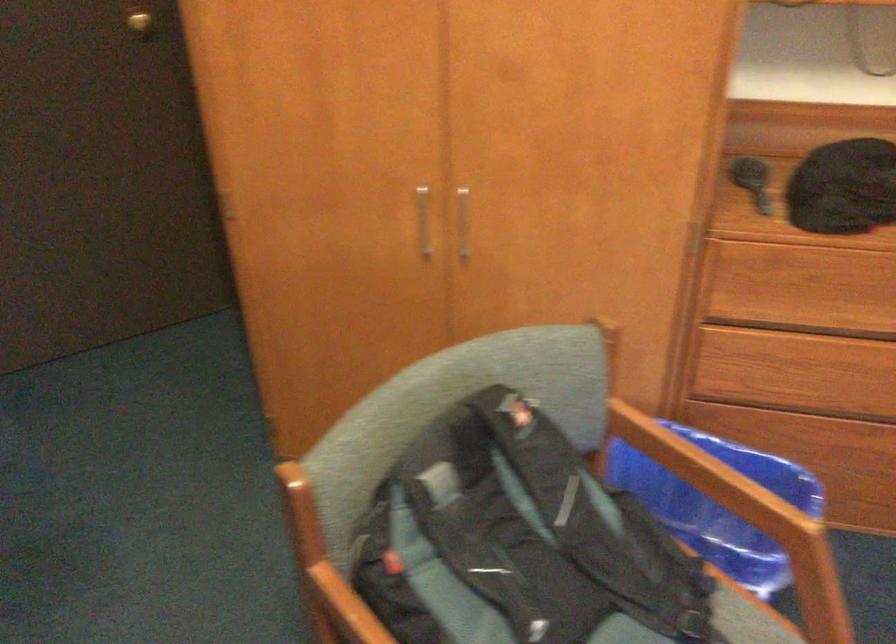
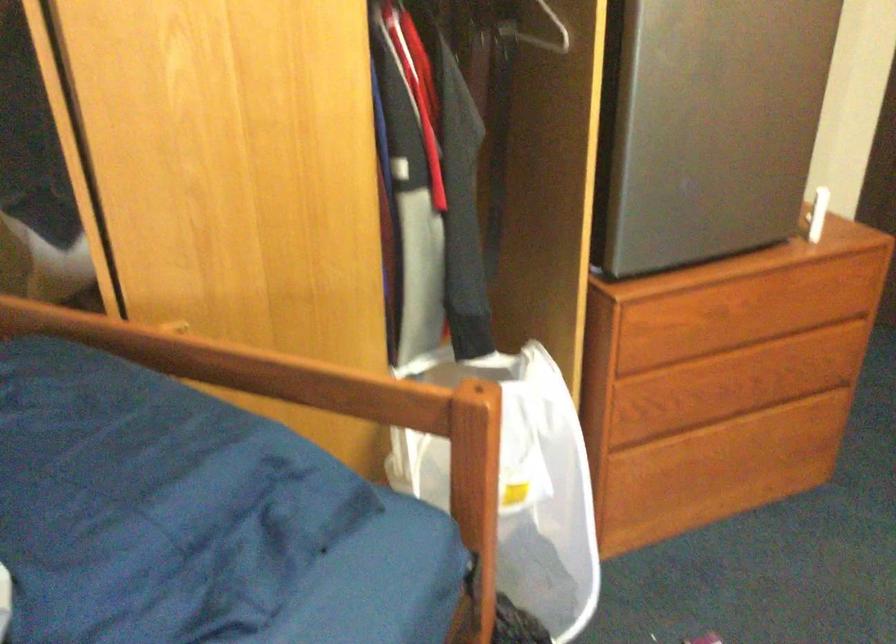
Question: Based on the continuous images, in which direction is the camera rotating? Reply with the corresponding letter.

Choices:
 (A) Left
 (B) Right
 (C) Up
 (D) Down

Answer: (A)